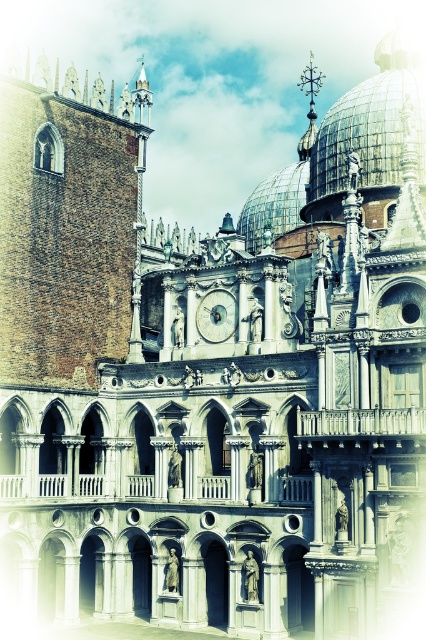
Question: Observing the image, what is the correct spatial positioning of shiny silver dome at upper right in reference to silver metallic clock at center?

Choices:
 (A) below
 (B) above

Answer: (B)

Question: In this image, where is shiny silver dome at upper right located relative to silver metallic clock at center?

Choices:
 (A) right
 (B) left

Answer: (A)

Question: Which object is farther from the camera taking this photo?

Choices:
 (A) shiny silver dome at upper right
 (B) silver metallic clock at center

Answer: (B)

Question: Does shiny silver dome at upper right have a larger size compared to silver metallic clock at center?

Choices:
 (A) no
 (B) yes

Answer: (B)